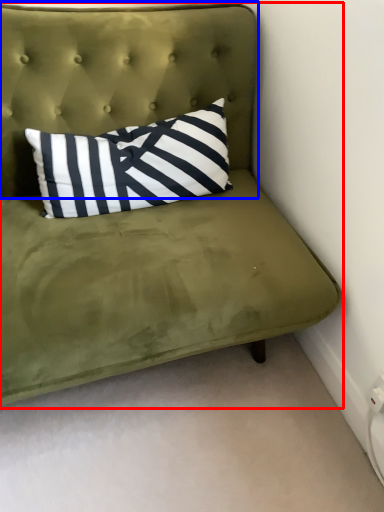
Question: Among these objects, which one is nearest to the camera, studio couch (highlighted by a red box) or headboard (highlighted by a blue box)?

Choices:
 (A) studio couch
 (B) headboard

Answer: (A)